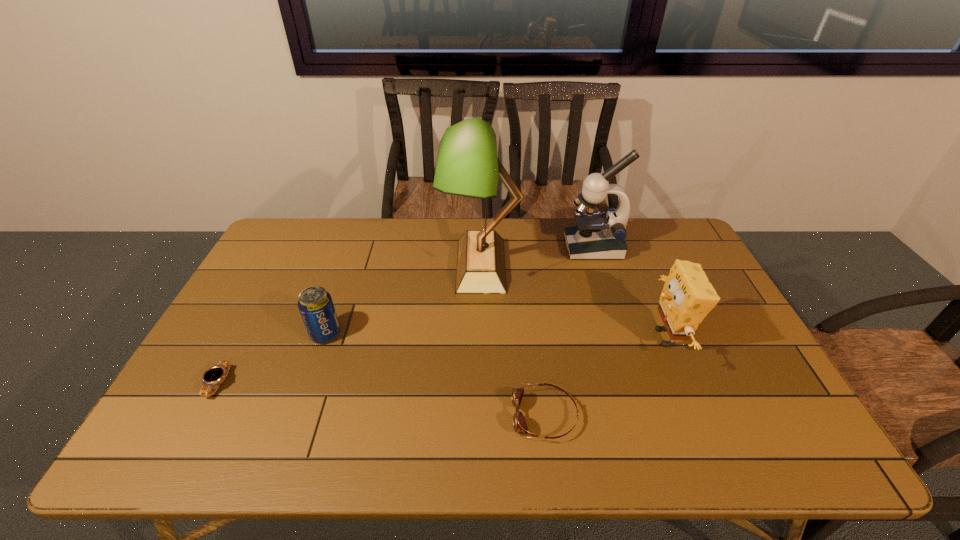
Find the location of a particular element. vacant space that's between the soda and the third tallest object is located at coordinates (495, 336).

Identify the location of free point between the sponge and the microscope. (630, 293).

Where is `blank region between the tallest object and the shortest object`? This screenshot has width=960, height=540. blank region between the tallest object and the shortest object is located at coordinates (350, 324).

The width and height of the screenshot is (960, 540). Find the location of `vacant space that's between the third tallest object and the second object from left to right`. vacant space that's between the third tallest object and the second object from left to right is located at coordinates (495, 336).

Locate an element on the screen. This screenshot has height=540, width=960. free space that is in between the third shortest object and the shortest object is located at coordinates (273, 359).

Where is `vacant area that lies between the watch and the goggles`? This screenshot has width=960, height=540. vacant area that lies between the watch and the goggles is located at coordinates (382, 400).

Identify the location of free point between the fourth shortest object and the second shortest object. (605, 376).

Image resolution: width=960 pixels, height=540 pixels. I want to click on unoccupied position between the goggles and the fifth shortest object, so click(x=569, y=332).

I want to click on free space between the tallest object and the microscope, so click(x=538, y=256).

This screenshot has width=960, height=540. What are the coordinates of `object that is the fifth closest to the goggles` in the screenshot? It's located at (215, 375).